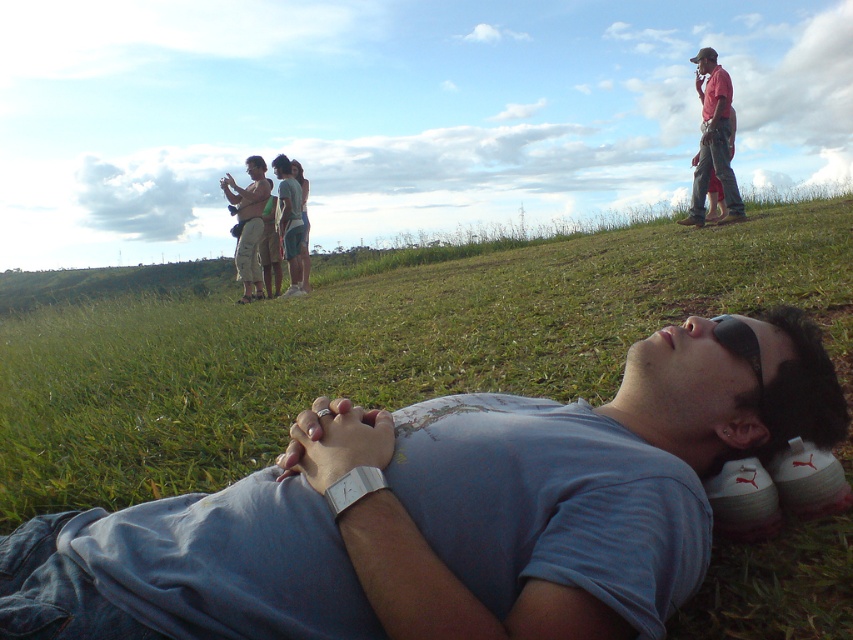
Is blue cotton shirt at lower center smaller than beige cotton shorts at center?

Yes.

Is blue cotton shirt at lower center taller than beige cotton shorts at center?

No.

This screenshot has height=640, width=853. Describe the element at coordinates (447, 509) in the screenshot. I see `blue cotton shirt at lower center` at that location.

This screenshot has width=853, height=640. Identify the location of blue cotton shirt at lower center. (447, 509).

Which is behind, point (683, 218) or point (231, 204)?

The point (683, 218) is more distant.

Who is positioned more to the left, matte pink shirt at upper right or beige cotton shorts at center?

beige cotton shorts at center is more to the left.

Is point (722, 104) positioned before point (242, 211)?

Yes, it is in front of point (242, 211).

Locate an element on the screen. Image resolution: width=853 pixels, height=640 pixels. matte pink shirt at upper right is located at coordinates (712, 140).

Who is higher up, blue cotton shirt at lower center or matte pink shirt at upper right?

matte pink shirt at upper right is above.

Is blue cotton shirt at lower center wider than matte pink shirt at upper right?

Yes.

Who is more distant from viewer, (117, 541) or (717, 96)?

The point (717, 96) is more distant.

The image size is (853, 640). I want to click on blue cotton shirt at lower center, so (447, 509).